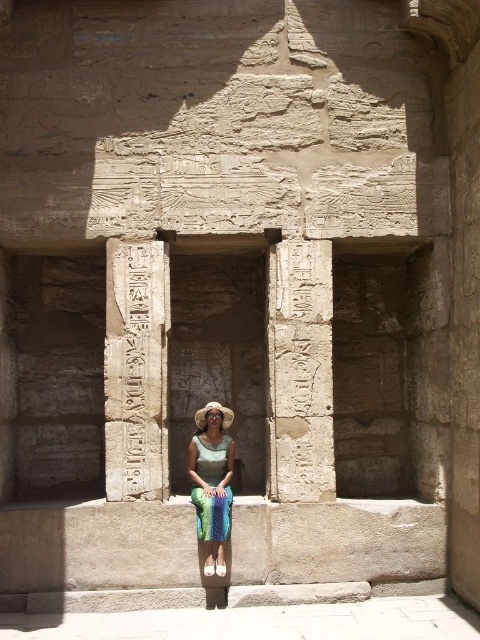
Question: Estimate the real-world distances between objects in this image. Which object is farther from the white stone hieroglyphics at center?

Choices:
 (A) carved stone hieroglyphs at center
 (B) shiny green dress at center

Answer: (A)

Question: Which object is positioned closest to the shiny green dress at center?

Choices:
 (A) white stone hieroglyphics at center
 (B) carved stone hieroglyphs at center

Answer: (A)

Question: Is white stone hieroglyphics at center positioned before shiny green dress at center?

Choices:
 (A) yes
 (B) no

Answer: (B)

Question: Which object appears closest to the camera in this image?

Choices:
 (A) white stone hieroglyphics at center
 (B) shiny green dress at center
 (C) carved stone hieroglyphs at center

Answer: (B)

Question: Does carved stone hieroglyphs at center appear on the left side of white stone hieroglyphics at center?

Choices:
 (A) yes
 (B) no

Answer: (B)

Question: Does carved stone hieroglyphs at center have a greater width compared to shiny green dress at center?

Choices:
 (A) no
 (B) yes

Answer: (B)